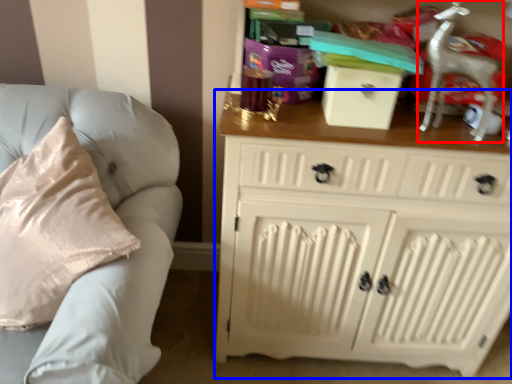
Question: Which object is further to the camera taking this photo, rocking chair (highlighted by a red box) or chest of drawers (highlighted by a blue box)?

Choices:
 (A) rocking chair
 (B) chest of drawers

Answer: (A)